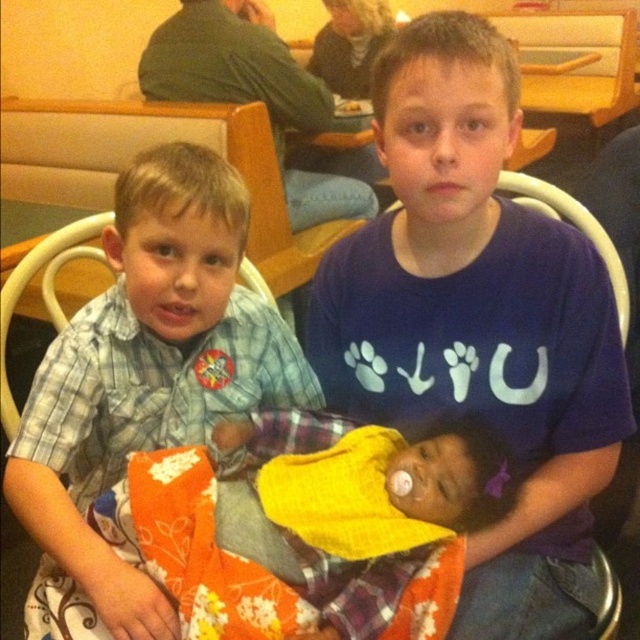
Question: Considering the relative positions of blue cotton shirt at center and orange floral fabric at center in the image provided, where is blue cotton shirt at center located with respect to orange floral fabric at center?

Choices:
 (A) right
 (B) left

Answer: (A)

Question: In this image, where is blue cotton shirt at center located relative to blue plaid shirt at center?

Choices:
 (A) left
 (B) right

Answer: (B)

Question: Based on their relative distances, which object is nearer to the blue plaid shirt at center?

Choices:
 (A) orange floral fabric at center
 (B) blue cotton shirt at center

Answer: (A)

Question: Considering the real-world distances, which object is closest to the blue cotton shirt at center?

Choices:
 (A) orange floral fabric at center
 (B) blue plaid shirt at center

Answer: (A)

Question: Does blue cotton shirt at center come in front of orange floral fabric at center?

Choices:
 (A) no
 (B) yes

Answer: (A)

Question: Which object is closer to the camera taking this photo?

Choices:
 (A) orange floral fabric at center
 (B) blue plaid shirt at center

Answer: (A)